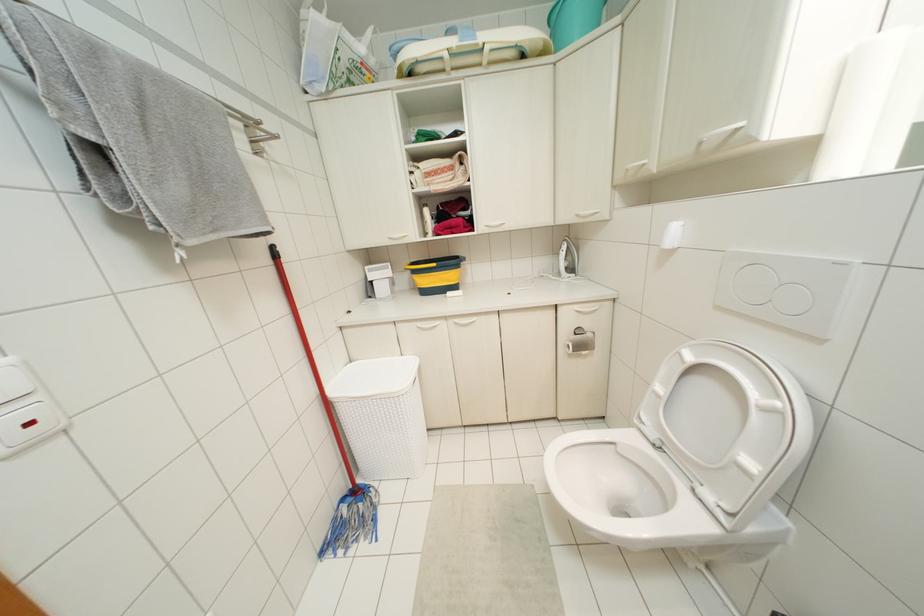
Find where to push the white light switch. Please return your answer as a coordinate pair (x, y).

(15, 379)